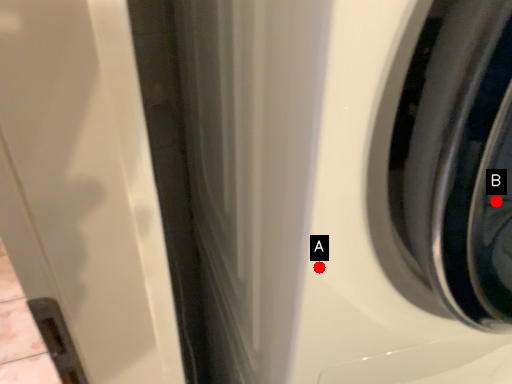
Question: Two points are circled on the image, labeled by A and B beside each circle. Which point is closer to the camera?

Choices:
 (A) A is closer
 (B) B is closer

Answer: (B)